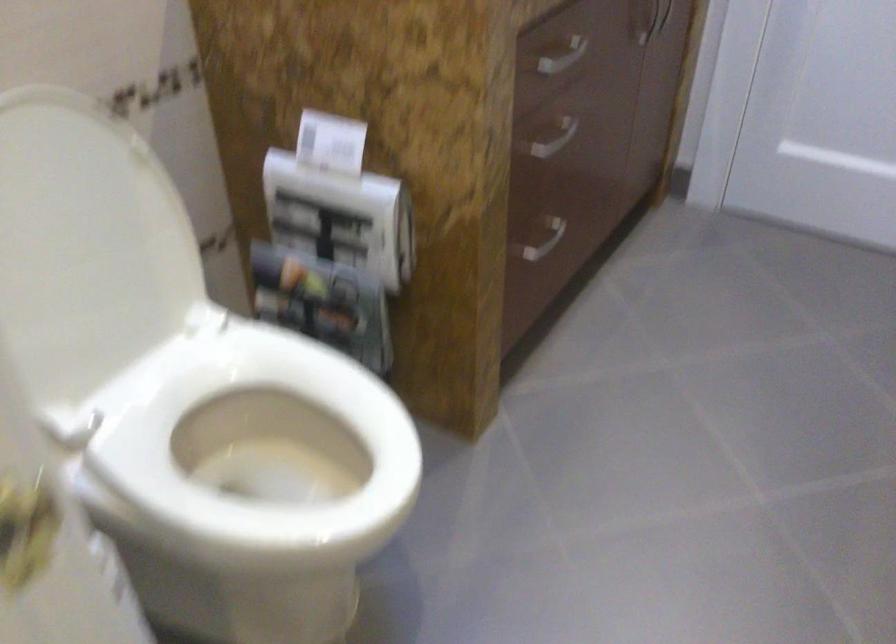
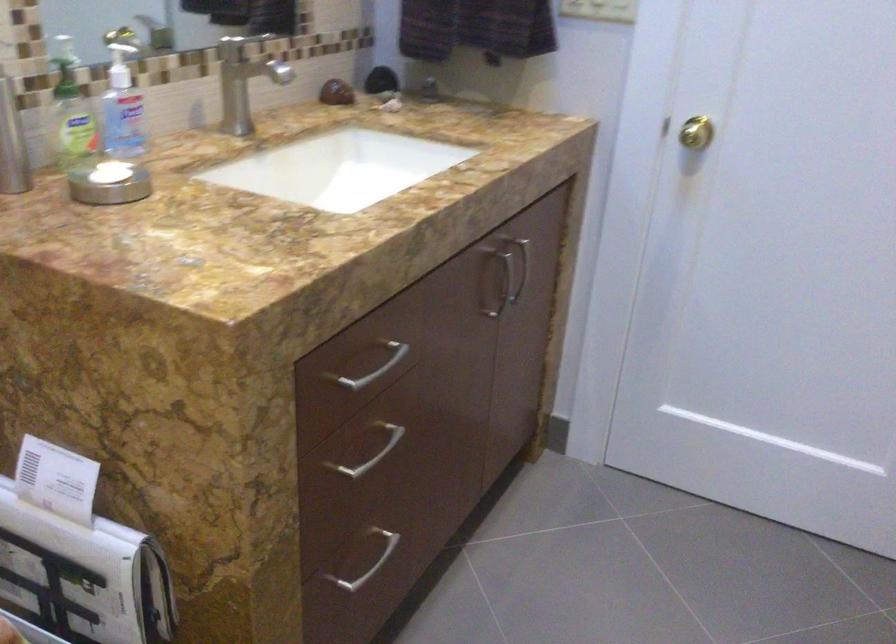
In a continuous first-person perspective shot, in which direction is the camera moving?

The cameraman walked toward right, forward.